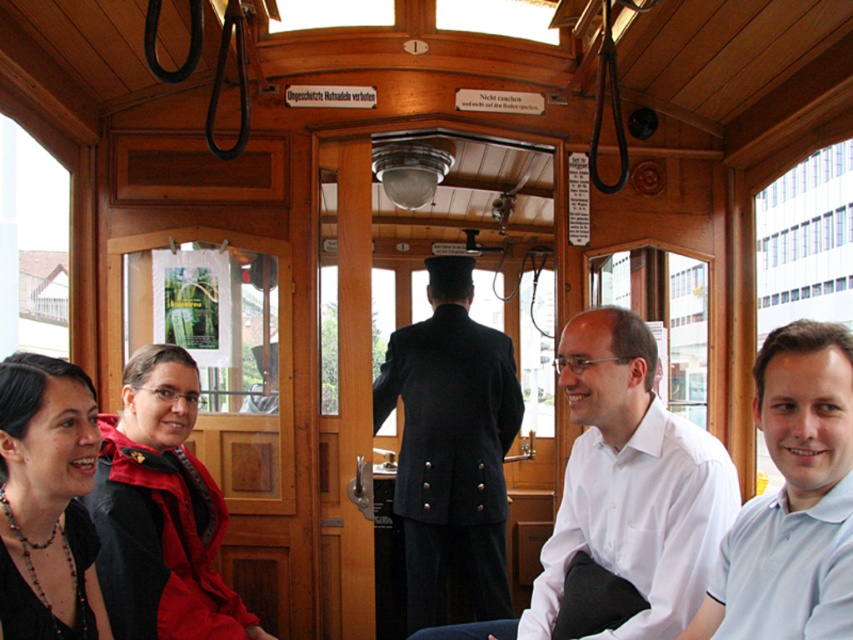
Can you confirm if white glossy shirt at center is wider than white cotton polo shirt at center?

Yes, white glossy shirt at center is wider than white cotton polo shirt at center.

Which is behind, point (717, 499) or point (730, 611)?

Positioned behind is point (717, 499).

Does point (616, 465) come farther from viewer compared to point (828, 545)?

Yes, it is.

Where is `white glossy shirt at center`? white glossy shirt at center is located at coordinates (625, 490).

Does white cotton polo shirt at center appear on the left side of red matte jacket at lower left?

Incorrect, white cotton polo shirt at center is not on the left side of red matte jacket at lower left.

Is white cotton polo shirt at center further to camera compared to red matte jacket at lower left?

No, white cotton polo shirt at center is in front of red matte jacket at lower left.

Who is more forward, (722, 540) or (218, 538)?

Point (722, 540) is more forward.

I want to click on white cotton polo shirt at center, so click(x=792, y=499).

Is white glossy shirt at center thinner than black matte jacket at lower left?

In fact, white glossy shirt at center might be wider than black matte jacket at lower left.

Between white glossy shirt at center and black matte jacket at lower left, which one appears on the left side from the viewer's perspective?

black matte jacket at lower left is more to the left.

Does point (674, 470) come closer to viewer compared to point (3, 540)?

No, (674, 470) is further to viewer.

Where is `white glossy shirt at center`? white glossy shirt at center is located at coordinates (625, 490).